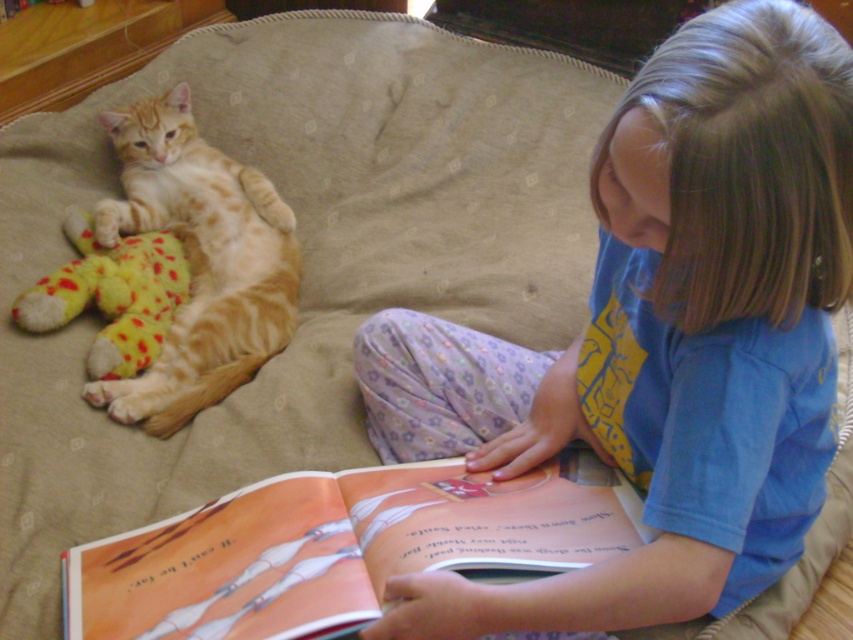
You are a parent trying to place a new decorative pillow on the couch. You want to put it between the matte orange book at lower center and the orange tabby cat at left. Which object should you place it closer to if you want the pillow to be closer to the taller object?

The orange tabby cat at left is taller than the matte orange book at lower center. Therefore, placing the decorative pillow closer to the orange tabby cat at left will position it nearer to the taller object.

You are a parent trying to put away toys. You see the orange tabby cat at left and the yellow plush toy at left on the couch. Which one can you pick up first without disturbing the cat?

The yellow plush toy at left can be picked up first since it is smaller than the orange tabby cat at left and less likely to disturb the cat.

From the picture: You are a delivery robot in the living room. You need to place a small package on the couch where the child is sitting. The couch is at point (735, 344). The robot has a maximum reach distance of 30 inches. Can you place the package directly on the couch without moving closer?

The distance of point (735, 344) from the camera is 32.47 inches, which is beyond the robot s maximum reach of 30 inches. Therefore, the robot cannot place the package directly on the couch without moving closer.